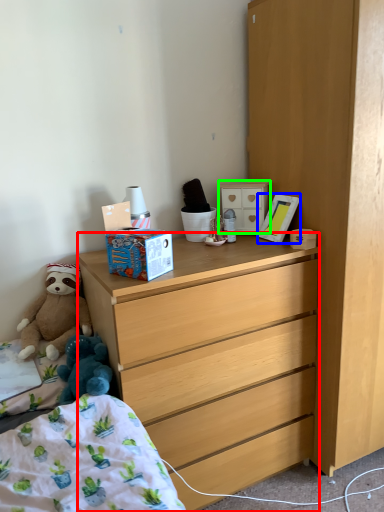
Question: Estimate the real-world distances between objects in this image. Which object is farther from desk (highlighted by a red box), picture frame (highlighted by a blue box) or cabinetry (highlighted by a green box)?

Choices:
 (A) picture frame
 (B) cabinetry

Answer: (B)